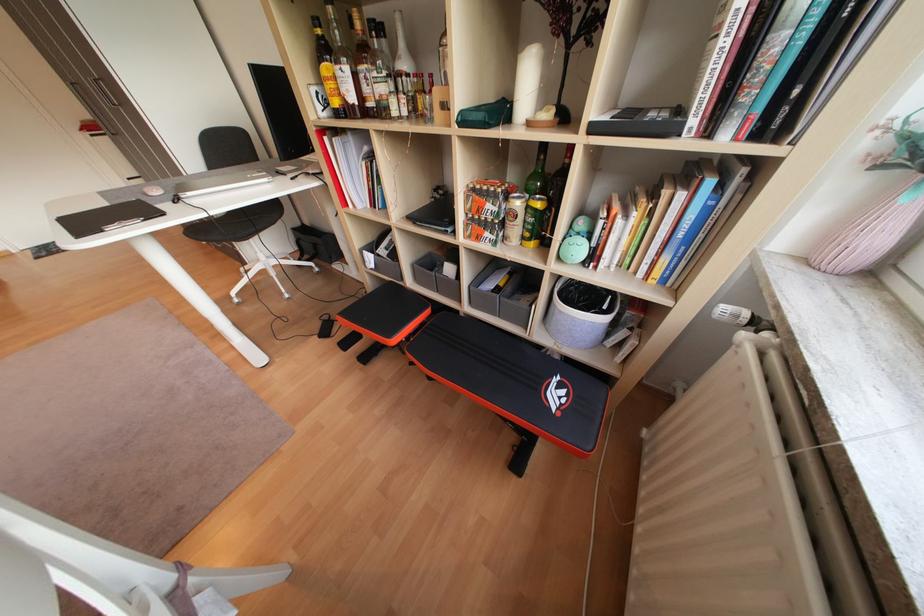
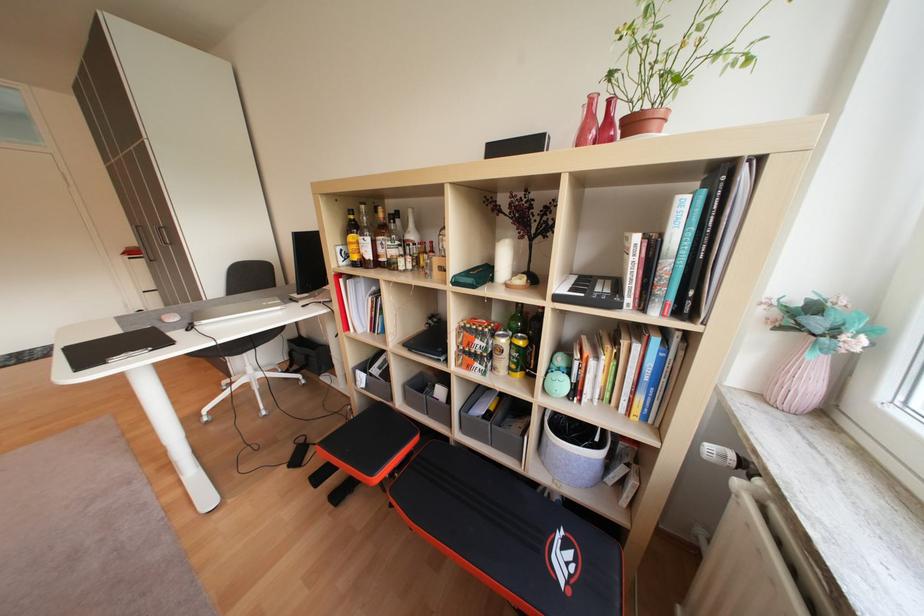
Question: How did the camera likely rotate?

Choices:
 (A) Left
 (B) Right
 (C) Up
 (D) Down

Answer: (C)